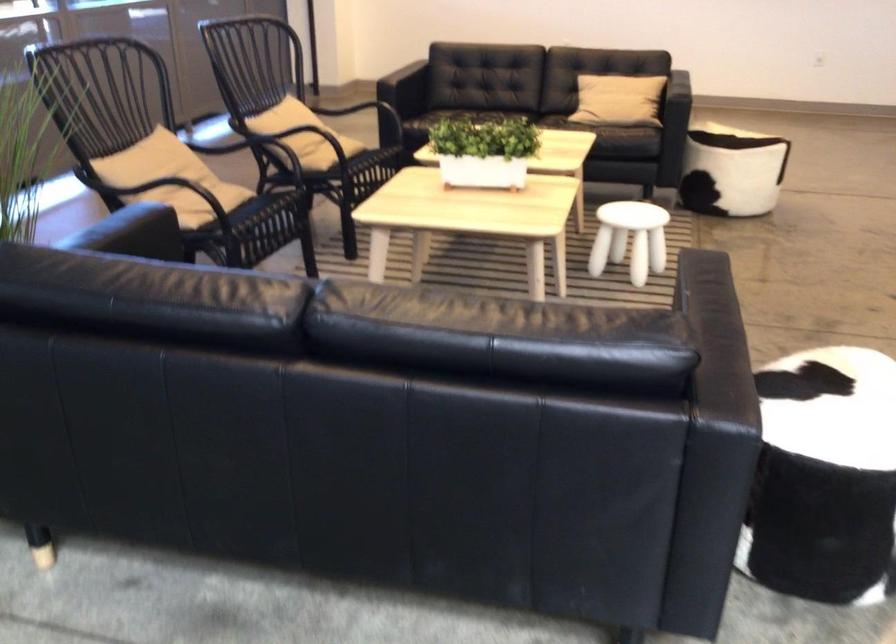
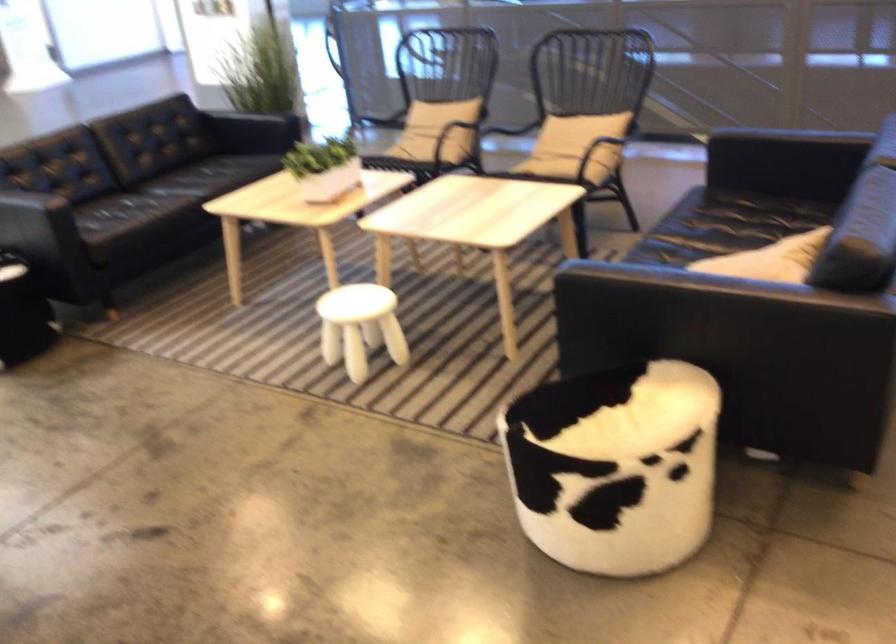
Find the pixel in the second image that matches [503,144] in the first image.

(323, 167)